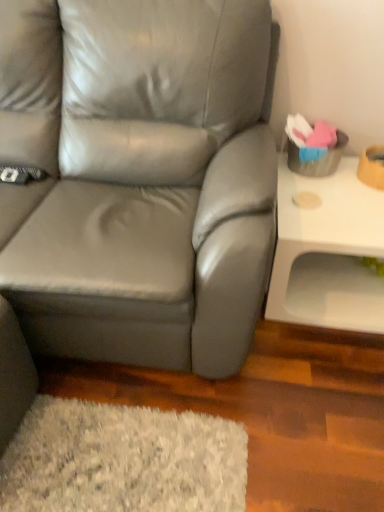
This screenshot has width=384, height=512. I want to click on vacant region in front of white glossy table at right, so click(x=310, y=381).